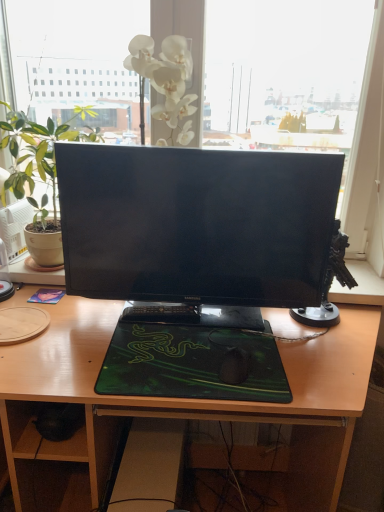
Identify the location of vacant space to the right of black plastic keyboard at center. The width and height of the screenshot is (384, 512). (224, 328).